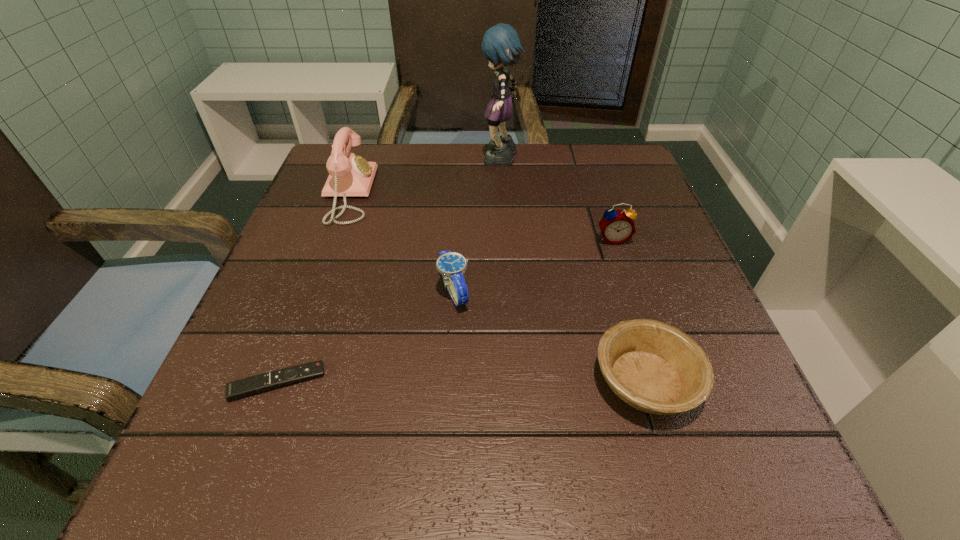
At what (x,y) coordinates should I click in order to perform the action: click on vacant point located between the bowl and the shortest object. Please return your answer as a coordinate pair (x, y). This screenshot has height=540, width=960. Looking at the image, I should click on (462, 381).

This screenshot has height=540, width=960. In order to click on free space that is in between the rag doll and the remote control in this screenshot , I will do `click(389, 272)`.

In order to click on vacant space that's between the fourth object from left to right and the fourth nearest object in this screenshot , I will do `click(557, 200)`.

At what (x,y) coordinates should I click in order to perform the action: click on empty location between the fifth tallest object and the fourth object from left to right. Please return your answer as a coordinate pair (x, y). Image resolution: width=960 pixels, height=540 pixels. Looking at the image, I should click on (573, 271).

Locate an element on the screen. empty space that is in between the fourth tallest object and the rag doll is located at coordinates (477, 226).

What are the coordinates of `free point between the fourth object from left to right and the bowl` in the screenshot? It's located at (573, 271).

Locate an element on the screen. The width and height of the screenshot is (960, 540). free space that is in between the watch and the third farthest object is located at coordinates (533, 265).

Where is `free space between the remote control and the third farthest object`? free space between the remote control and the third farthest object is located at coordinates (445, 310).

This screenshot has height=540, width=960. Find the location of `free spot between the fifth shortest object and the fifth tallest object`. free spot between the fifth shortest object and the fifth tallest object is located at coordinates (497, 287).

I want to click on empty location between the fifth tallest object and the third tallest object, so click(x=629, y=310).